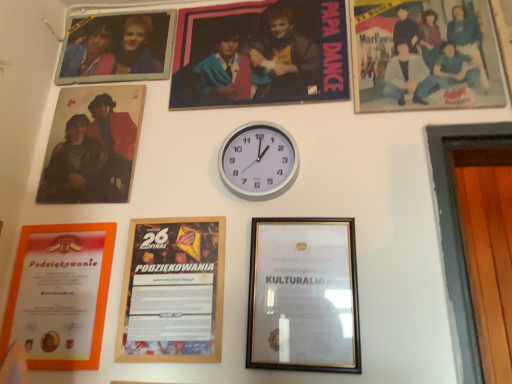
Question: Is point (41, 200) closer or farther from the camera than point (105, 263)?

Choices:
 (A) closer
 (B) farther

Answer: (B)

Question: From a real-world perspective, is matte wooden photo frame at upper left, the 2th picture frame in the left-to-right sequence, above or below orange paper certificate at lower left, which appears as the first picture frame when viewed from the left?

Choices:
 (A) above
 (B) below

Answer: (A)

Question: Which object is positioned closest to the orange paper certificate at lower left, arranged as the 7th picture frame when viewed from the right?

Choices:
 (A) matte wooden photo frame at upper left, the 2th picture frame in the left-to-right sequence
 (B) gold metallic picture frame at center, the second picture frame when ordered from right to left
 (C) metallic photo frame at upper left, the fifth picture frame in the right-to-left sequence
 (D) white metallic clock at center
 (E) matte plastic photo at upper right, the 7th picture frame from the left

Answer: (A)

Question: Based on their relative distances, which object is farther from the gold metallic picture frame at center, the second picture frame when ordered from right to left?

Choices:
 (A) matte wooden photo frame at upper left, which is counted as the 6th picture frame, starting from the right
 (B) matte plastic photo at upper right, arranged as the 1th picture frame when viewed from the right
 (C) white metallic clock at center
 (D) matte plastic poster at upper center, positioned as the fifth picture frame in left-to-right order
 (E) orange paper certificate at lower left, which appears as the first picture frame when viewed from the left

Answer: (A)